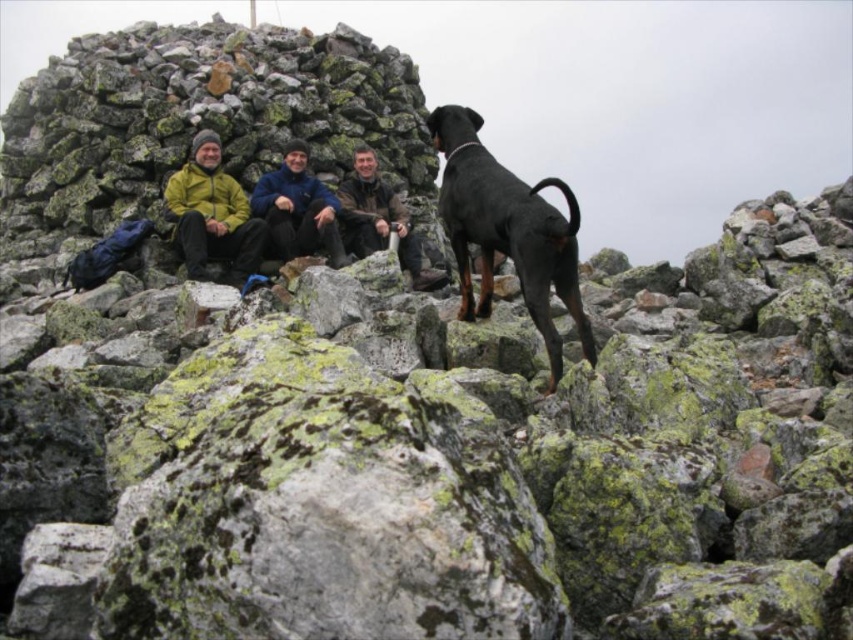
Question: Considering the real-world distances, which object is closest to the matte yellow jacket at center?

Choices:
 (A) black smooth doberman at center
 (B) dark brown leather jacket at center
 (C) blue fleece jacket at center

Answer: (C)

Question: Can you confirm if blue fleece jacket at center is positioned to the left of dark brown leather jacket at center?

Choices:
 (A) yes
 (B) no

Answer: (A)

Question: Is matte yellow jacket at center positioned before dark brown leather jacket at center?

Choices:
 (A) no
 (B) yes

Answer: (B)

Question: Which object appears closest to the camera in this image?

Choices:
 (A) matte yellow jacket at center
 (B) black smooth doberman at center
 (C) dark brown leather jacket at center
 (D) blue fleece jacket at center

Answer: (B)

Question: Is blue fleece jacket at center thinner than dark brown leather jacket at center?

Choices:
 (A) yes
 (B) no

Answer: (A)

Question: Which object appears farthest from the camera in this image?

Choices:
 (A) blue fleece jacket at center
 (B) dark brown leather jacket at center

Answer: (B)